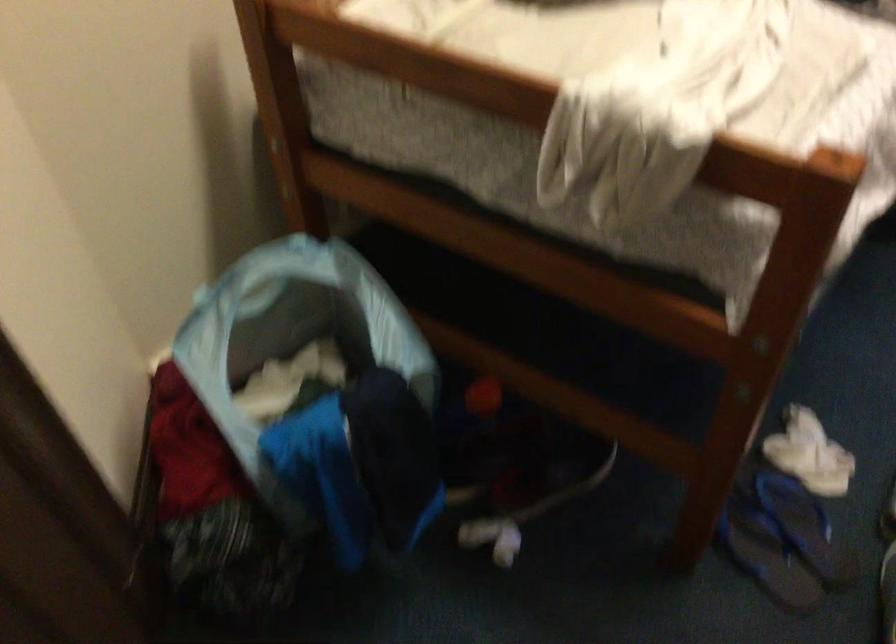
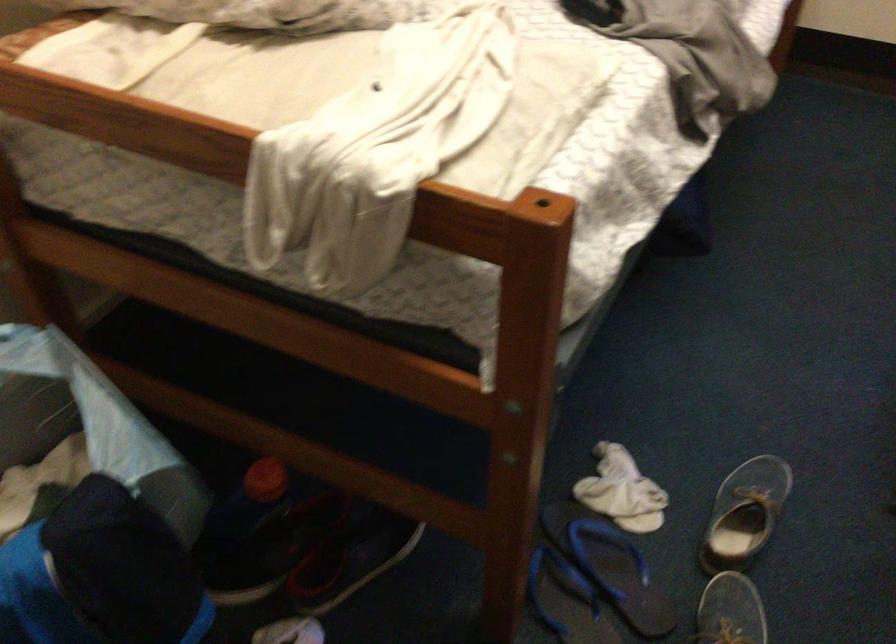
Locate, in the second image, the point that corresponds to pixel 808 455 in the first image.

(622, 491)